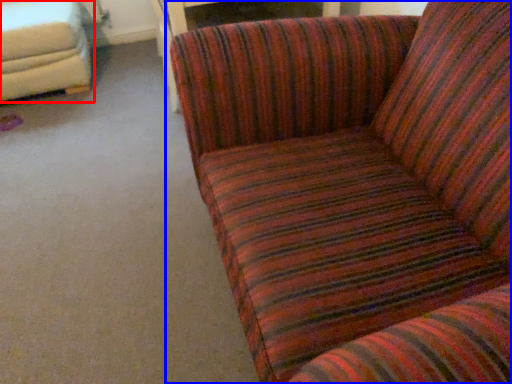
Question: Which of the following is the farthest to the observer, studio couch (highlighted by a red box) or studio couch (highlighted by a blue box)?

Choices:
 (A) studio couch
 (B) studio couch

Answer: (A)